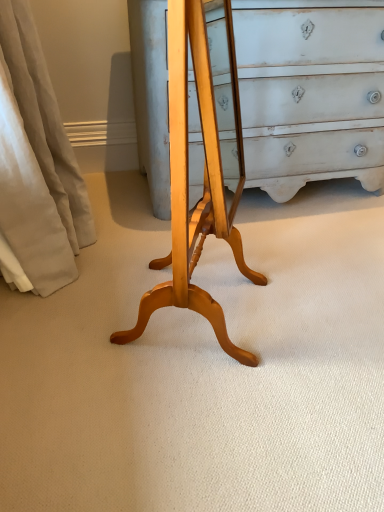
Measure the distance between light wood changing table at center and camera.

The depth of light wood changing table at center is 27.91 inches.

Describe the element at coordinates (204, 177) in the screenshot. The width and height of the screenshot is (384, 512). I see `light wood changing table at center` at that location.

You are a GUI agent. You are given a task and a screenshot of the screen. Output one action in this format:
    pyautogui.click(x=<x>, y=<y>)
    Task: Click on the light wood changing table at center
    Image resolution: width=384 pixels, height=512 pixels.
    Given the screenshot: What is the action you would take?
    pyautogui.click(x=204, y=177)

What is the approximate height of beige fabric curtain at left?

beige fabric curtain at left is 33.38 inches in height.

Identify the location of beige fabric curtain at left. This screenshot has width=384, height=512. (36, 165).

This screenshot has height=512, width=384. What do you see at coordinates (36, 165) in the screenshot?
I see `beige fabric curtain at left` at bounding box center [36, 165].

At what (x,y) coordinates should I click in order to perform the action: click on light wood changing table at center. Please return your answer as a coordinate pair (x, y). Looking at the image, I should click on (204, 177).

Considering the relative positions of beige fabric curtain at left and light wood changing table at center in the image provided, is beige fabric curtain at left to the right of light wood changing table at center from the viewer's perspective?

Incorrect, beige fabric curtain at left is not on the right side of light wood changing table at center.

Which is behind, beige fabric curtain at left or light wood changing table at center?

Positioned behind is beige fabric curtain at left.

Which is in front, point (35, 68) or point (207, 52)?

Point (35, 68)

Consider the image. From the image's perspective, is beige fabric curtain at left located above or below light wood changing table at center?

beige fabric curtain at left is situated higher than light wood changing table at center in the image.

From a real-world perspective, which object stands above the other?

From a 3D spatial view, light wood changing table at center is above.

In terms of width, does beige fabric curtain at left look wider or thinner when compared to light wood changing table at center?

In the image, beige fabric curtain at left appears to be wider than light wood changing table at center.

Which of these two, beige fabric curtain at left or light wood changing table at center, stands taller?

light wood changing table at center.

Who is bigger, beige fabric curtain at left or light wood changing table at center?

beige fabric curtain at left is bigger.

In the scene shown: Is beige fabric curtain at left positioned beyond the bounds of light wood changing table at center?

That's correct, beige fabric curtain at left is outside of light wood changing table at center.

Is beige fabric curtain at left directly adjacent to light wood changing table at center?

No.

Is beige fabric curtain at left facing towards light wood changing table at center?

No, beige fabric curtain at left is not oriented towards light wood changing table at center.

Consider the image. How many degrees apart are the facing directions of beige fabric curtain at left and light wood changing table at center?

64.4 degrees separate the facing orientations of beige fabric curtain at left and light wood changing table at center.

This screenshot has width=384, height=512. Identify the location of changing table below the beige fabric curtain at left (from the image's perspective). (204, 177).

Can you confirm if light wood changing table at center is positioned to the right of beige fabric curtain at left?

Yes, light wood changing table at center is to the right of beige fabric curtain at left.

Considering the positions of objects light wood changing table at center and beige fabric curtain at left in the image provided, who is behind, light wood changing table at center or beige fabric curtain at left?

beige fabric curtain at left is further from the camera.

Does point (170, 116) appear closer or farther from the camera than point (15, 45)?

Point (170, 116).

From the image's perspective, which is below, light wood changing table at center or beige fabric curtain at left?

light wood changing table at center.

From a real-world perspective, is light wood changing table at center on beige fabric curtain at left?

Yes, from a real-world perspective, light wood changing table at center is on top of beige fabric curtain at left.

In terms of width, does light wood changing table at center look wider or thinner when compared to beige fabric curtain at left?

light wood changing table at center is thinner than beige fabric curtain at left.

Which of these two, light wood changing table at center or beige fabric curtain at left, stands shorter?

beige fabric curtain at left is shorter.

In terms of size, does light wood changing table at center appear bigger or smaller than beige fabric curtain at left?

Clearly, light wood changing table at center is smaller in size than beige fabric curtain at left.

Is beige fabric curtain at left surrounded by light wood changing table at center?

Actually, beige fabric curtain at left is outside light wood changing table at center.

Is light wood changing table at center not near beige fabric curtain at left?

They are positioned close to each other.

Looking at this image, is light wood changing table at center facing towards beige fabric curtain at left?

No, light wood changing table at center is not aimed at beige fabric curtain at left.

How many degrees apart are the facing directions of light wood changing table at center and beige fabric curtain at left?

The angle between the facing direction of light wood changing table at center and the facing direction of beige fabric curtain at left is 64.4 degrees.

Where is `curtain behind the light wood changing table at center`? curtain behind the light wood changing table at center is located at coordinates (36, 165).

Identify the location of curtain lying on the left of light wood changing table at center. (36, 165).

Identify the location of changing table located above the beige fabric curtain at left (from a real-world perspective). This screenshot has width=384, height=512. (204, 177).